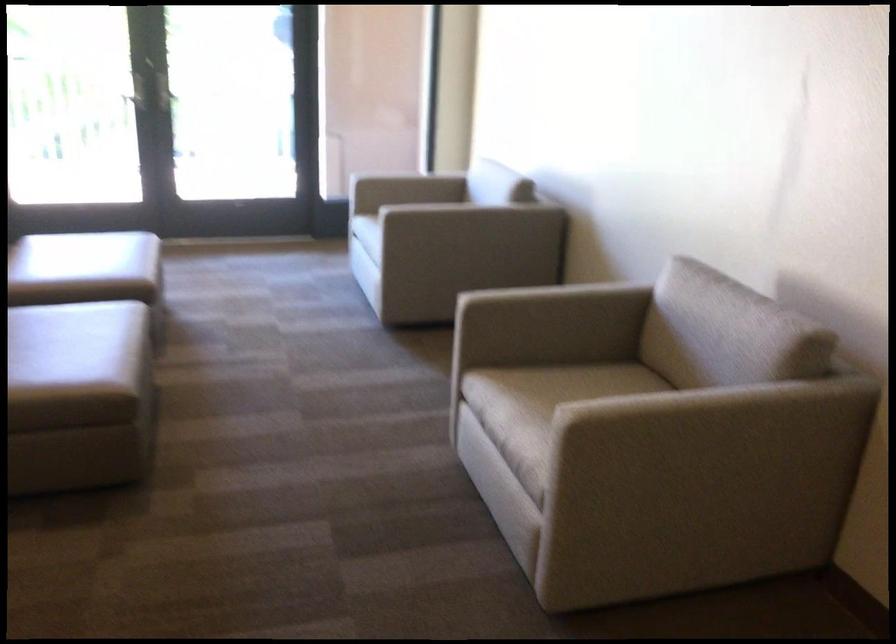
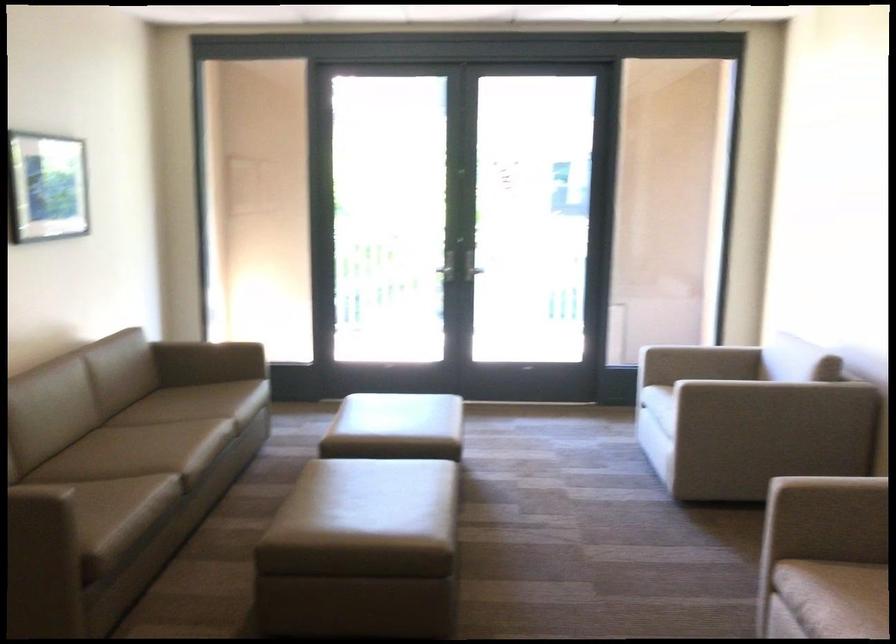
Locate, in the second image, the point that corresponds to (x=522, y=386) in the first image.

(856, 591)